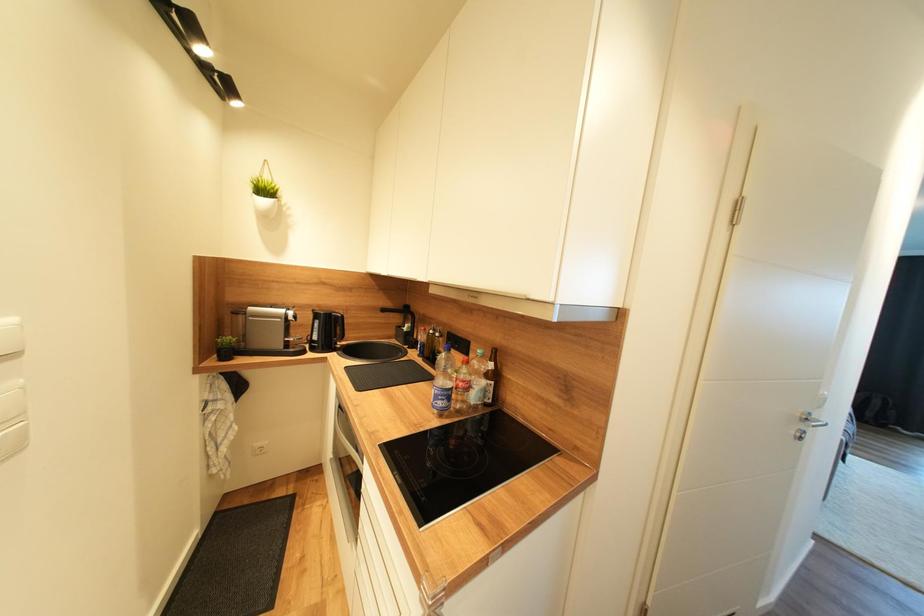
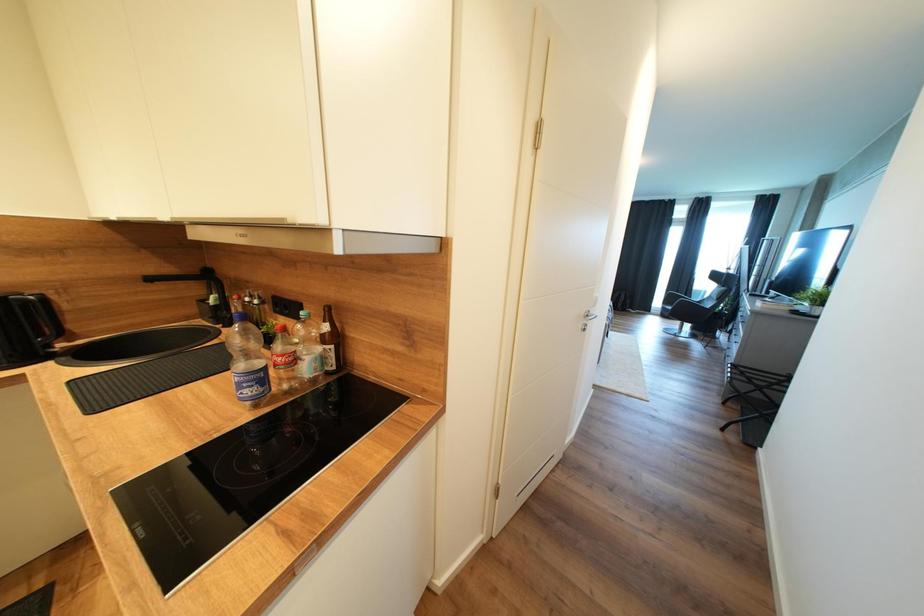
Question: The camera is either moving clockwise (left) or counter-clockwise (right) around the object. The first image is from the beginning of the video and the second image is from the end. Is the camera moving left or right when shooting the video?

Choices:
 (A) Left
 (B) Right

Answer: (A)